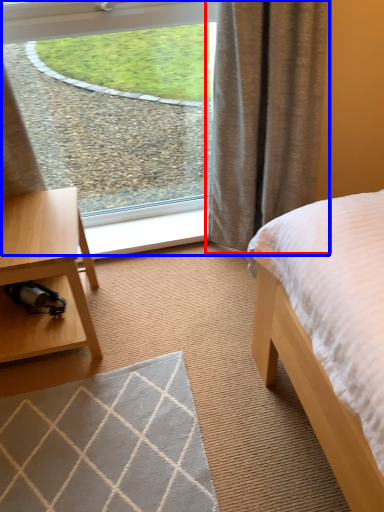
Question: Which object appears closest to the camera in this image, curtain (highlighted by a red box) or window (highlighted by a blue box)?

Choices:
 (A) curtain
 (B) window

Answer: (A)